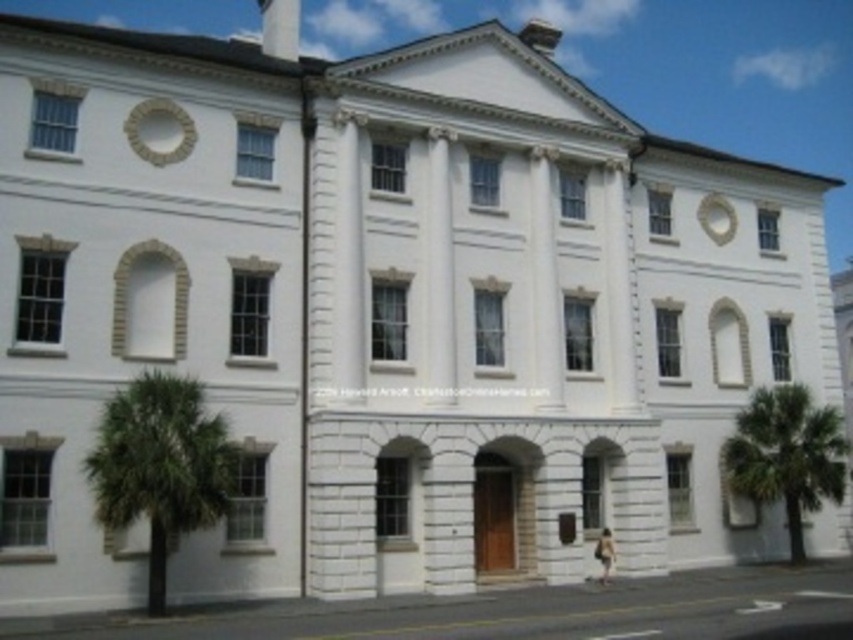
You are standing at the entrance of the grand white building and want to walk to the green leafy palm tree at right. There is a path that goes directly between the two palm trees. If you start walking from the entrance, will you pass by the green leafy palm tree at lower left before reaching your destination?

The green leafy palm tree at lower left is 113.15 feet away from green leafy palm tree at right. Since you are starting at the entrance and walking towards the palm tree at right, you would not pass by the palm tree at lower left because they are positioned on opposite sides of the path, not in a straight line from the entrance to the destination.